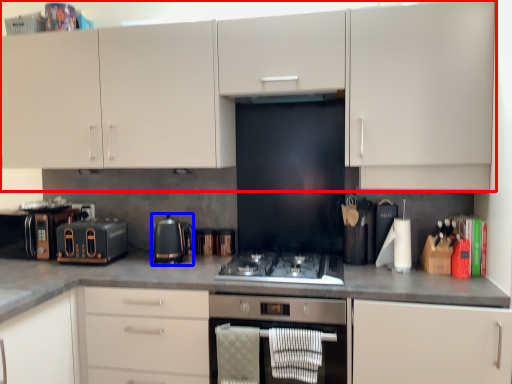
Question: Which object appears closest to the camera in this image, cabinetry (highlighted by a red box) or kitchen appliance (highlighted by a blue box)?

Choices:
 (A) cabinetry
 (B) kitchen appliance

Answer: (A)